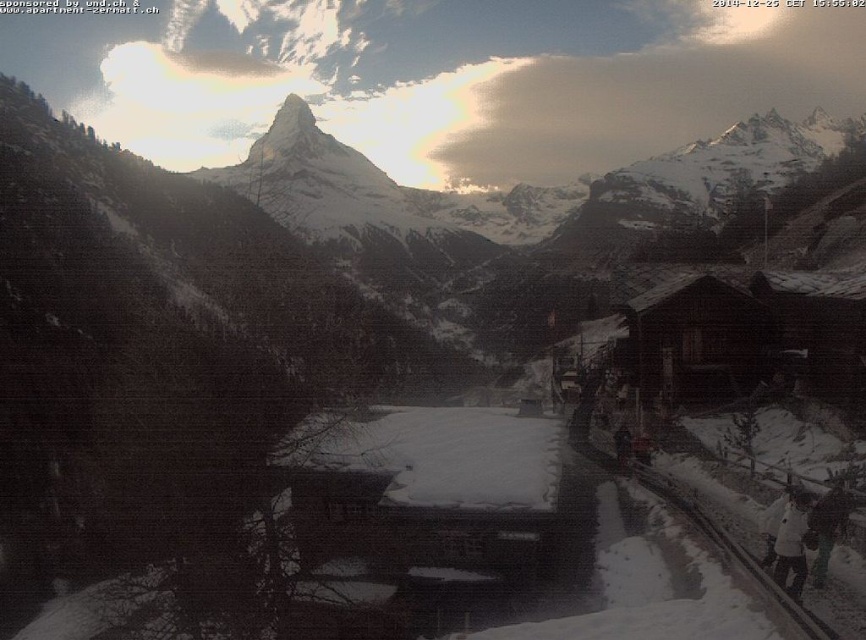
Question: Estimate the real-world distances between objects in this image. Which object is farther from the dark gray metal train track at lower right?

Choices:
 (A) white snowboarder at lower right
 (B) wooden cabin at right

Answer: (B)

Question: Among these points, which one is nearest to the camera?

Choices:
 (A) (645, 467)
 (B) (774, 308)

Answer: (A)

Question: Which of the following is the farthest from the observer?

Choices:
 (A) click(x=712, y=520)
 (B) click(x=624, y=374)
 (C) click(x=789, y=556)

Answer: (B)

Question: In this image, where is wooden cabin at right located relative to dark gray metal train track at lower right?

Choices:
 (A) above
 (B) below

Answer: (A)

Question: Is wooden cabin at right thinner than dark gray metal train track at lower right?

Choices:
 (A) no
 (B) yes

Answer: (A)

Question: Is wooden cabin at right to the left of dark gray metal train track at lower right from the viewer's perspective?

Choices:
 (A) yes
 (B) no

Answer: (B)